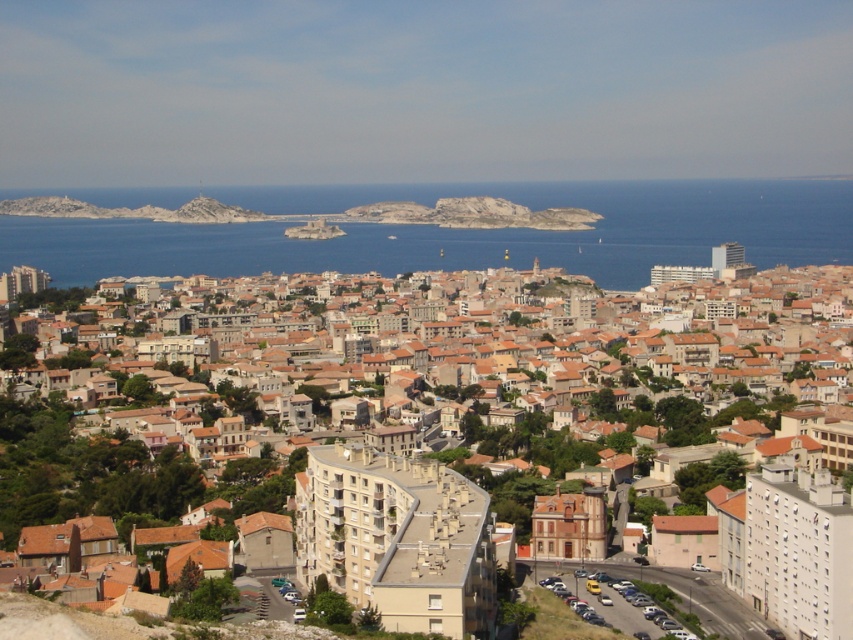
In the scene shown: Between brown textured buildings at center and blue water at center, which one is positioned higher?

blue water at center

Is point (679, 371) in front of point (161, 264)?

Yes, it is.

The height and width of the screenshot is (640, 853). I want to click on brown textured buildings at center, so click(633, 403).